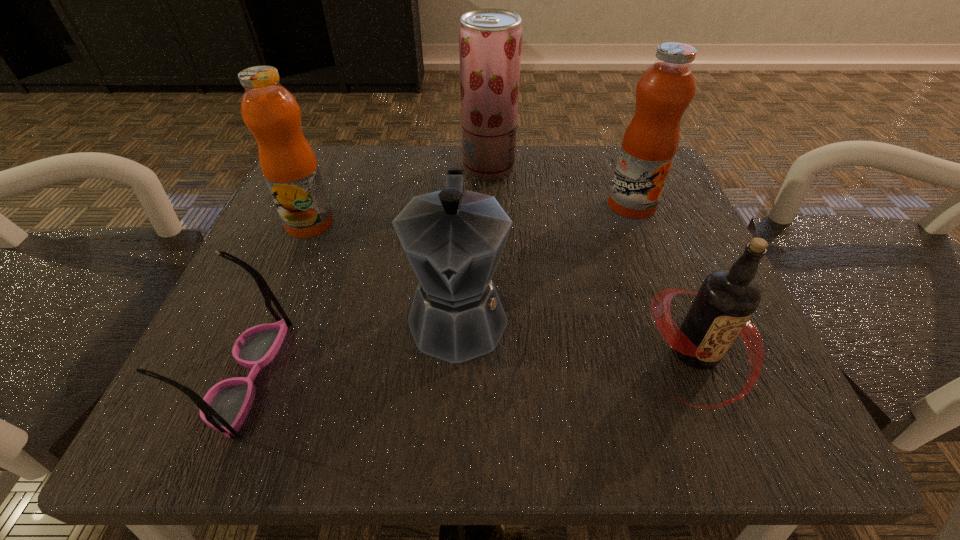
Identify the location of free space between the rightmost fruit juice and the farthest fruit juice. (560, 187).

Find the location of a particular element. The image size is (960, 540). empty space between the root beer and the rightmost fruit juice is located at coordinates (664, 279).

This screenshot has width=960, height=540. In order to click on free spot between the spectacles and the leftmost fruit juice in this screenshot , I will do [279, 299].

Identify the location of free space between the spectacles and the root beer. (472, 364).

Find the location of a particular element. unoccupied area between the shortest object and the leftmost fruit juice is located at coordinates point(279,299).

I want to click on free area in between the spectacles and the farthest object, so click(369, 271).

Find the location of a particular element. free spot between the coffeepot and the shortest object is located at coordinates (353, 345).

Identify the location of unoccupied area between the rightmost fruit juice and the root beer. The image size is (960, 540). (664, 279).

Locate an element on the screen. free space between the second fruit juice from right to left and the root beer is located at coordinates (592, 260).

Locate which object is the closest to the farthest fruit juice. Please provide its 2D coordinates. Your answer should be formatted as a tuple, i.e. [(x, y)], where the tuple contains the x and y coordinates of a point satisfying the conditions above.

[(664, 91)]